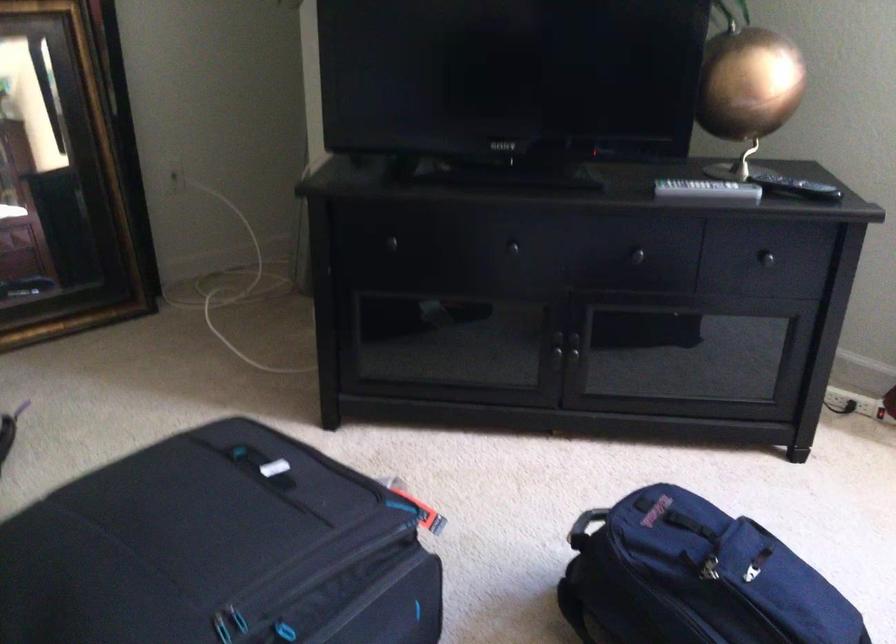
This screenshot has width=896, height=644. Find the location of `bronze desk globe`. bronze desk globe is located at coordinates pos(746,88).